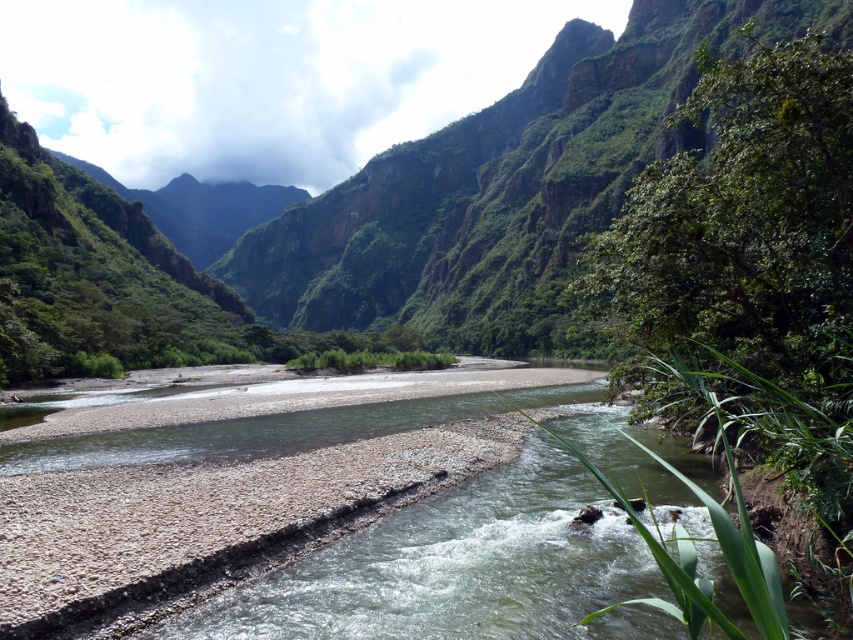
Question: Which point is closer to the camera taking this photo?

Choices:
 (A) (788, 400)
 (B) (508, 163)

Answer: (A)

Question: Does green leafy tree at right appear over green rocky mountain at center?

Choices:
 (A) no
 (B) yes

Answer: (A)

Question: Which object appears farthest from the camera in this image?

Choices:
 (A) green leafy tree at right
 (B) green rocky mountain at center

Answer: (B)

Question: Is green leafy tree at right smaller than green rocky mountain at center?

Choices:
 (A) no
 (B) yes

Answer: (B)

Question: Does green leafy tree at right come behind green rocky mountain at center?

Choices:
 (A) no
 (B) yes

Answer: (A)